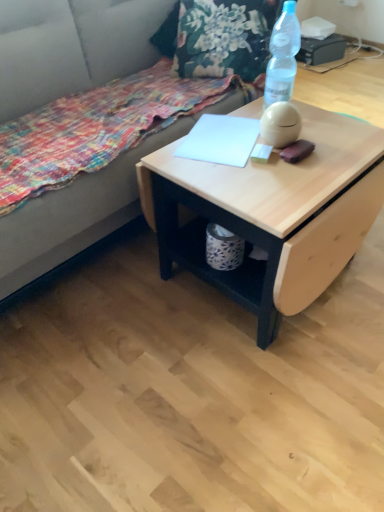
Locate an element on the screen. vacant area in front of transparent plastic bottle at upper right is located at coordinates (319, 137).